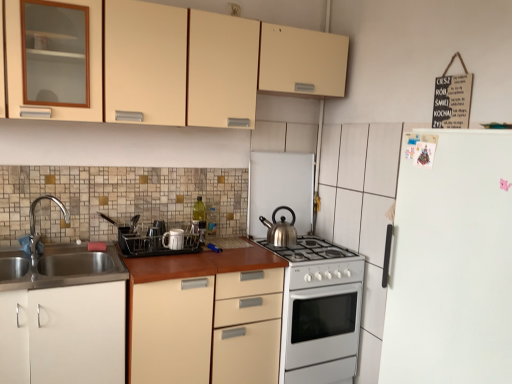
Where is `empty space that is to the right of glossy ceramic mug at center, which is the 2th appliance from back to front`? The image size is (512, 384). empty space that is to the right of glossy ceramic mug at center, which is the 2th appliance from back to front is located at coordinates (196, 253).